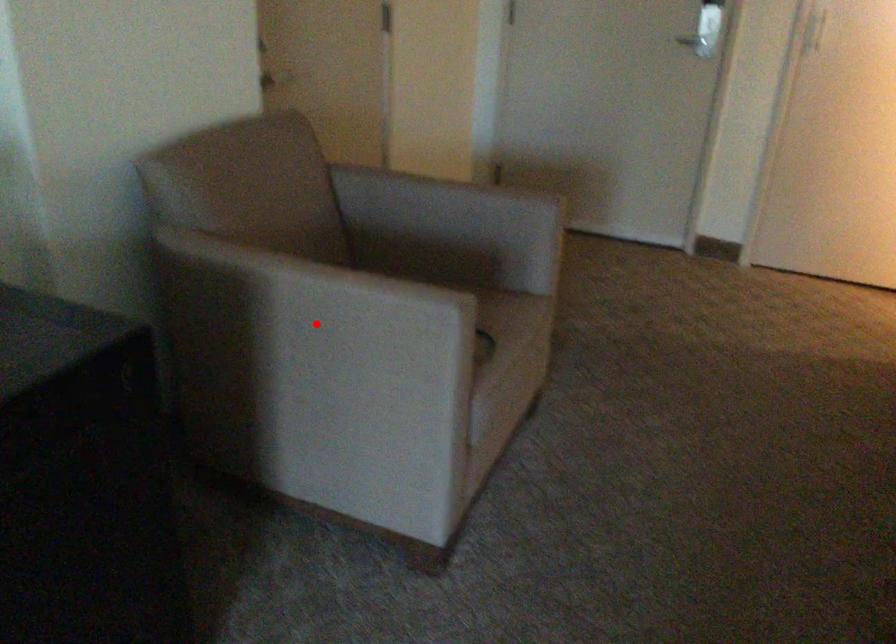
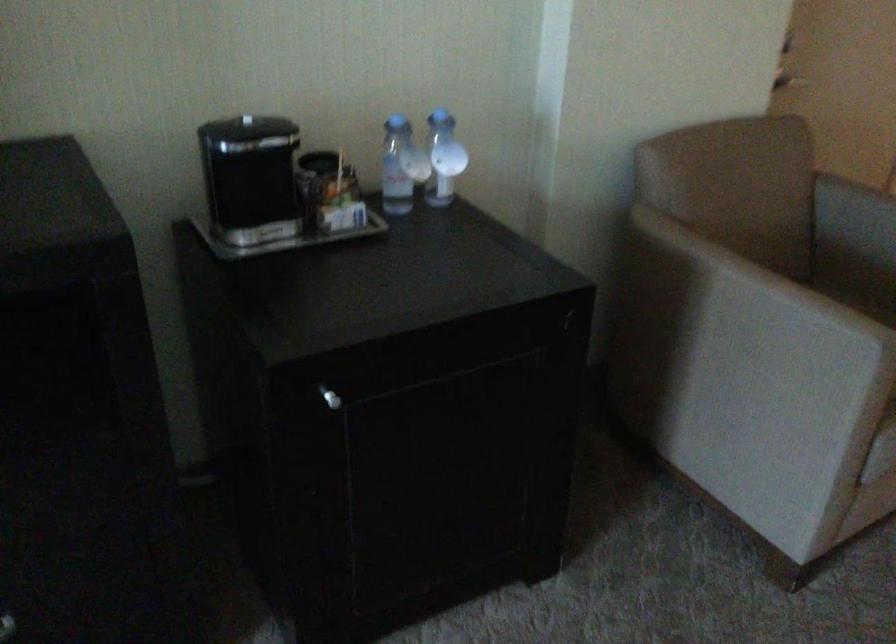
In the second image, find the point that corresponds to the highlighted location in the first image.

(739, 319)